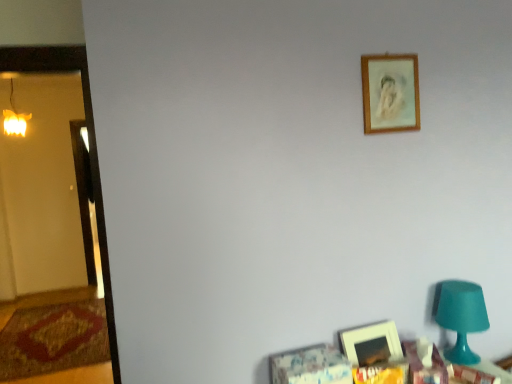
Question: Considering the relative sizes of warm yellow glass at left and wooden table at lower right in the image provided, is warm yellow glass at left smaller than wooden table at lower right?

Choices:
 (A) no
 (B) yes

Answer: (A)

Question: Is warm yellow glass at left at the right side of wooden table at lower right?

Choices:
 (A) yes
 (B) no

Answer: (B)

Question: Is warm yellow glass at left positioned behind wooden table at lower right?

Choices:
 (A) yes
 (B) no

Answer: (A)

Question: Is warm yellow glass at left not near wooden table at lower right?

Choices:
 (A) no
 (B) yes

Answer: (B)

Question: Is the surface of warm yellow glass at left in direct contact with wooden table at lower right?

Choices:
 (A) no
 (B) yes

Answer: (A)

Question: Could you tell me if warm yellow glass at left is facing wooden table at lower right?

Choices:
 (A) yes
 (B) no

Answer: (B)

Question: Considering the relative sizes of wooden frame at upper right, which is the second picture frame in bottom-to-top order, and warm yellow glass at left in the image provided, is wooden frame at upper right, which is the second picture frame in bottom-to-top order, smaller than warm yellow glass at left?

Choices:
 (A) yes
 (B) no

Answer: (A)

Question: From a real-world perspective, is wooden frame at upper right, which is the second picture frame in bottom-to-top order, physically above warm yellow glass at left?

Choices:
 (A) no
 (B) yes

Answer: (A)

Question: Does wooden frame at upper right, arranged as the 1th picture frame when viewed from the top, have a larger size compared to warm yellow glass at left?

Choices:
 (A) yes
 (B) no

Answer: (B)

Question: From a real-world perspective, is wooden frame at upper right, which is the second picture frame in bottom-to-top order, positioned under warm yellow glass at left based on gravity?

Choices:
 (A) yes
 (B) no

Answer: (A)

Question: Does wooden frame at upper right, arranged as the 1th picture frame when viewed from the top, appear on the right side of warm yellow glass at left?

Choices:
 (A) no
 (B) yes

Answer: (B)

Question: Does wooden frame at upper right, which is the second picture frame in bottom-to-top order, contain warm yellow glass at left?

Choices:
 (A) no
 (B) yes

Answer: (A)

Question: Can you confirm if wooden table at lower right is bigger than warm yellow glass at left?

Choices:
 (A) yes
 (B) no

Answer: (B)